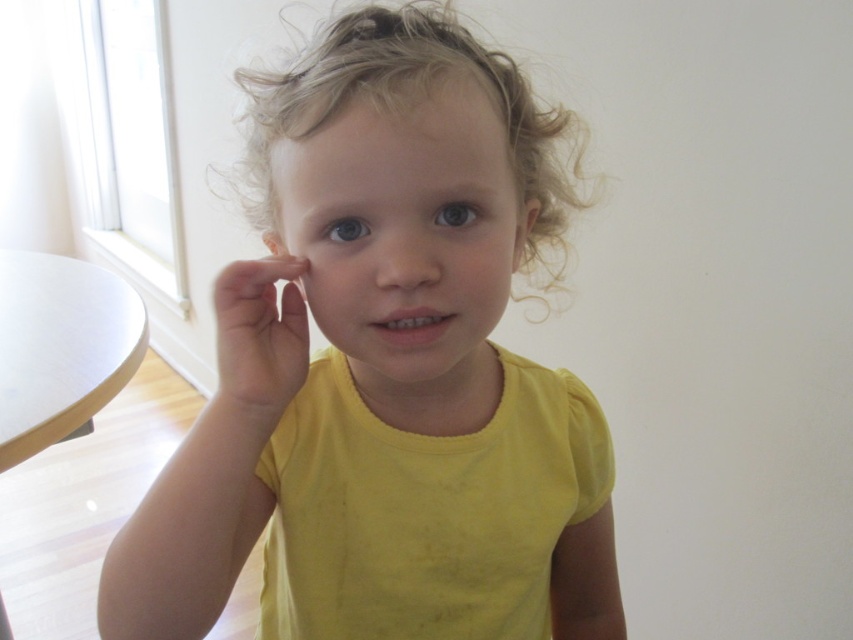
Based on the scene description, if you were to draw a straight line from the curly blonde hair at center to the white matte table at left, would the line pass through the window on the left side of the frame?

The curly blonde hair at center is located above the white matte table at left, so a straight line between them would not pass through the window on the left side of the frame since the window is on the left side while the table is already at the left.

Looking at the image, which object is positioned higher between the yellow matte shirt at center and the curly blonde hair at center?

The yellow matte shirt at center is much taller than the curly blonde hair at center, so it is positioned higher.